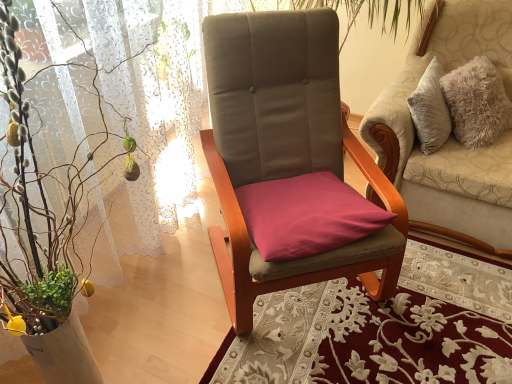
This screenshot has width=512, height=384. What do you see at coordinates (306, 215) in the screenshot?
I see `purple fabric cushion at center` at bounding box center [306, 215].

In order to face velvet beige chair at center, positioned as the first chair in right-to-left order, should I rotate leftwards or rightwards?

To face it directly, rotate right by 25.956 degrees.

Image resolution: width=512 pixels, height=384 pixels. In order to click on suede-like beige chair at center, marked as the second chair in a right-to-left arrangement in this screenshot , I will do `click(285, 149)`.

Identify the location of green leafy plant at left. (47, 229).

Find the location of a particular element. The height and width of the screenshot is (384, 512). purple fabric cushion at center is located at coordinates (306, 215).

Does suede-like beige chair at center, the 1th chair when ordered from left to right, have a smaller size compared to green leafy plant at left?

Actually, suede-like beige chair at center, the 1th chair when ordered from left to right, might be larger than green leafy plant at left.

Which of these two, suede-like beige chair at center, marked as the second chair in a right-to-left arrangement, or green leafy plant at left, stands taller?

green leafy plant at left.

Is suede-like beige chair at center, the 1th chair when ordered from left to right, positioned behind green leafy plant at left?

Yes, suede-like beige chair at center, the 1th chair when ordered from left to right, is behind green leafy plant at left.

Which is behind, point (278, 49) or point (59, 292)?

The point (278, 49) is farther from the camera.

From the picture: Is green leafy plant at left positioned beyond the bounds of purple fabric cushion at center?

Yes.

Does green leafy plant at left lie in front of purple fabric cushion at center?

Yes, it is in front of purple fabric cushion at center.

What are the coordinates of `houseplant below the purple fabric cushion at center (from the image's perspective)` in the screenshot? It's located at (47, 229).

Considering the positions of point (38, 366) and point (250, 234), is point (38, 366) closer or farther from the camera than point (250, 234)?

Point (38, 366).

Considering the positions of point (337, 229) and point (394, 281), is point (337, 229) closer or farther from the camera than point (394, 281)?

Clearly, point (337, 229) is closer to the camera than point (394, 281).

Can you confirm if purple fabric cushion at center is positioned to the left of suede-like beige chair at center, marked as the second chair in a right-to-left arrangement?

Incorrect, purple fabric cushion at center is not on the left side of suede-like beige chair at center, marked as the second chair in a right-to-left arrangement.

Is purple fabric cushion at center directly adjacent to suede-like beige chair at center, marked as the second chair in a right-to-left arrangement?

No, purple fabric cushion at center is not with suede-like beige chair at center, marked as the second chair in a right-to-left arrangement.

Based on the photo, is green leafy plant at left oriented away from velvet beige chair at center, the 2th chair from the left?

No.

From the image's perspective, is green leafy plant at left located above or below velvet beige chair at center, positioned as the first chair in right-to-left order?

green leafy plant at left is below velvet beige chair at center, positioned as the first chair in right-to-left order.

Image resolution: width=512 pixels, height=384 pixels. In order to click on houseplant located on the left of velvet beige chair at center, positioned as the first chair in right-to-left order in this screenshot , I will do `click(47, 229)`.

Between green leafy plant at left and velvet beige chair at center, positioned as the first chair in right-to-left order, which one is positioned in front?

green leafy plant at left is closer to the camera.

Is suede-like beige chair at center, the 1th chair when ordered from left to right, at the back of green leafy plant at left?

No, suede-like beige chair at center, the 1th chair when ordered from left to right, is not at the back of green leafy plant at left.

Is point (54, 303) less distant than point (307, 279)?

Yes, point (54, 303) is closer to viewer.

In terms of width, does green leafy plant at left look wider or thinner when compared to suede-like beige chair at center, marked as the second chair in a right-to-left arrangement?

Considering their sizes, green leafy plant at left looks slimmer than suede-like beige chair at center, marked as the second chair in a right-to-left arrangement.

Which is behind, point (505, 237) or point (286, 138)?

The point (505, 237) is more distant.

From the picture: From the image's perspective, relative to suede-like beige chair at center, the 1th chair when ordered from left to right, is velvet beige chair at center, the 2th chair from the left, above or below?

velvet beige chair at center, the 2th chair from the left, is above suede-like beige chair at center, the 1th chair when ordered from left to right.

The height and width of the screenshot is (384, 512). What are the coordinates of `chair below the suede-like beige chair at center, marked as the second chair in a right-to-left arrangement (from a real-world perspective)` in the screenshot? It's located at (450, 136).

Who is shorter, velvet beige chair at center, the 2th chair from the left, or suede-like beige chair at center, the 1th chair when ordered from left to right?

Standing shorter between the two is velvet beige chair at center, the 2th chair from the left.

Can we say suede-like beige chair at center, marked as the second chair in a right-to-left arrangement, lies outside purple fabric cushion at center?

suede-like beige chair at center, marked as the second chair in a right-to-left arrangement, lies outside purple fabric cushion at center's area.

From a real-world perspective, is suede-like beige chair at center, marked as the second chair in a right-to-left arrangement, positioned over purple fabric cushion at center based on gravity?

Yes, from a real-world perspective, suede-like beige chair at center, marked as the second chair in a right-to-left arrangement, is on top of purple fabric cushion at center.

Considering the positions of objects suede-like beige chair at center, the 1th chair when ordered from left to right, and purple fabric cushion at center in the image provided, who is in front, suede-like beige chair at center, the 1th chair when ordered from left to right, or purple fabric cushion at center?

suede-like beige chair at center, the 1th chair when ordered from left to right.

From the image's perspective, which one is positioned higher, suede-like beige chair at center, marked as the second chair in a right-to-left arrangement, or purple fabric cushion at center?

suede-like beige chair at center, marked as the second chair in a right-to-left arrangement.

Where is `houseplant positioned vertically above the suede-like beige chair at center, the 1th chair when ordered from left to right (from a real-world perspective)`? houseplant positioned vertically above the suede-like beige chair at center, the 1th chair when ordered from left to right (from a real-world perspective) is located at coordinates click(x=47, y=229).

You are a GUI agent. You are given a task and a screenshot of the screen. Output one action in this format:
    pyautogui.click(x=<x>, y=<y>)
    Task: Click on the houseplant in front of the purple fabric cushion at center
    
    Given the screenshot: What is the action you would take?
    pyautogui.click(x=47, y=229)

When comparing their distances from purple fabric cushion at center, does green leafy plant at left or velvet beige chair at center, the 2th chair from the left, seem closer?

Among the two, green leafy plant at left is located nearer to purple fabric cushion at center.

Considering their positions, is velvet beige chair at center, positioned as the first chair in right-to-left order, positioned further to purple fabric cushion at center than green leafy plant at left?

velvet beige chair at center, positioned as the first chair in right-to-left order, is further to purple fabric cushion at center.

From the picture: Which object lies nearer to the anchor point green leafy plant at left, purple fabric cushion at center or suede-like beige chair at center, the 1th chair when ordered from left to right?

suede-like beige chair at center, the 1th chair when ordered from left to right, is positioned closer to the anchor green leafy plant at left.

Based on their spatial positions, is purple fabric cushion at center or green leafy plant at left closer to suede-like beige chair at center, the 1th chair when ordered from left to right?

purple fabric cushion at center is positioned closer to the anchor suede-like beige chair at center, the 1th chair when ordered from left to right.

Looking at the image, which one is located closer to suede-like beige chair at center, marked as the second chair in a right-to-left arrangement, purple fabric cushion at center or velvet beige chair at center, positioned as the first chair in right-to-left order?

Among the two, purple fabric cushion at center is located nearer to suede-like beige chair at center, marked as the second chair in a right-to-left arrangement.

When comparing their distances from suede-like beige chair at center, marked as the second chair in a right-to-left arrangement, does green leafy plant at left or purple fabric cushion at center seem closer?

purple fabric cushion at center is positioned closer to the anchor suede-like beige chair at center, marked as the second chair in a right-to-left arrangement.

Considering their positions, is green leafy plant at left positioned closer to velvet beige chair at center, the 2th chair from the left, than purple fabric cushion at center?

The object closer to velvet beige chair at center, the 2th chair from the left, is purple fabric cushion at center.

Which object lies further to the anchor point purple fabric cushion at center, velvet beige chair at center, positioned as the first chair in right-to-left order, or suede-like beige chair at center, the 1th chair when ordered from left to right?

Based on the image, velvet beige chair at center, positioned as the first chair in right-to-left order, appears to be further to purple fabric cushion at center.

Where is `pillow between suede-like beige chair at center, marked as the second chair in a right-to-left arrangement, and velvet beige chair at center, positioned as the first chair in right-to-left order, from left to right`? Image resolution: width=512 pixels, height=384 pixels. pillow between suede-like beige chair at center, marked as the second chair in a right-to-left arrangement, and velvet beige chair at center, positioned as the first chair in right-to-left order, from left to right is located at coordinates (306, 215).

Where is `pillow between green leafy plant at left and velvet beige chair at center, the 2th chair from the left`? The height and width of the screenshot is (384, 512). pillow between green leafy plant at left and velvet beige chair at center, the 2th chair from the left is located at coordinates (306, 215).

This screenshot has width=512, height=384. I want to click on chair between green leafy plant at left and velvet beige chair at center, the 2th chair from the left, from left to right, so click(285, 149).

Identify the location of chair between green leafy plant at left and purple fabric cushion at center along the z-axis. (285, 149).